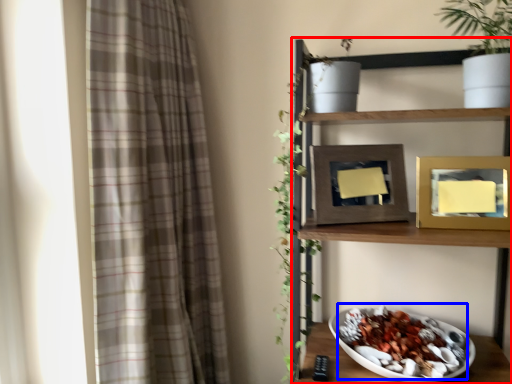
Question: Which point is further to the camera, shelf (highlighted by a red box) or food (highlighted by a blue box)?

Choices:
 (A) shelf
 (B) food

Answer: (B)